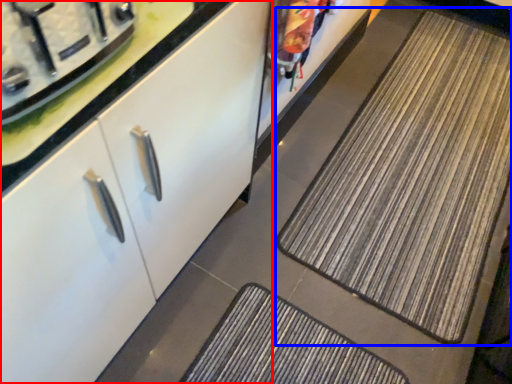
Question: Among these objects, which one is farthest to the camera, cabinetry (highlighted by a red box) or mat (highlighted by a blue box)?

Choices:
 (A) cabinetry
 (B) mat

Answer: (B)